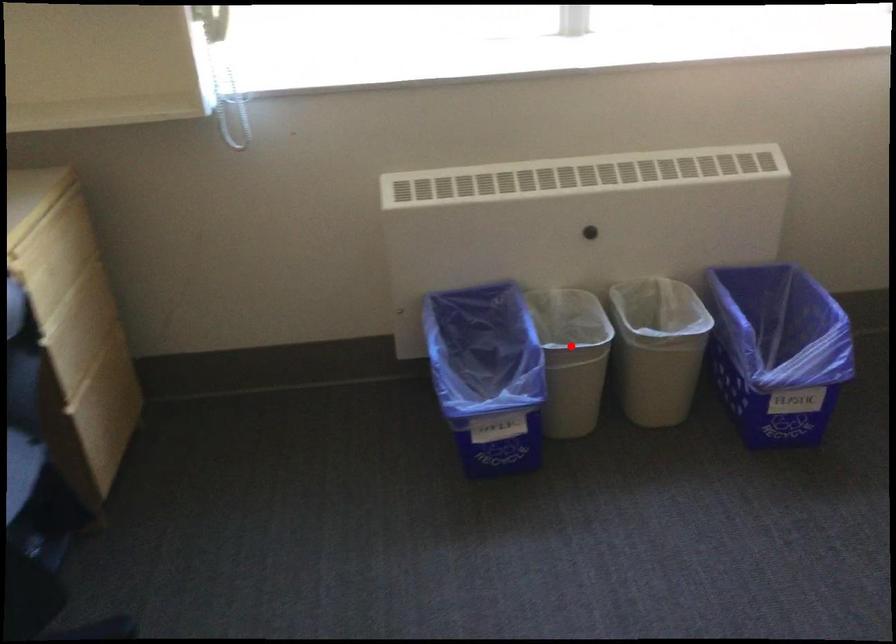
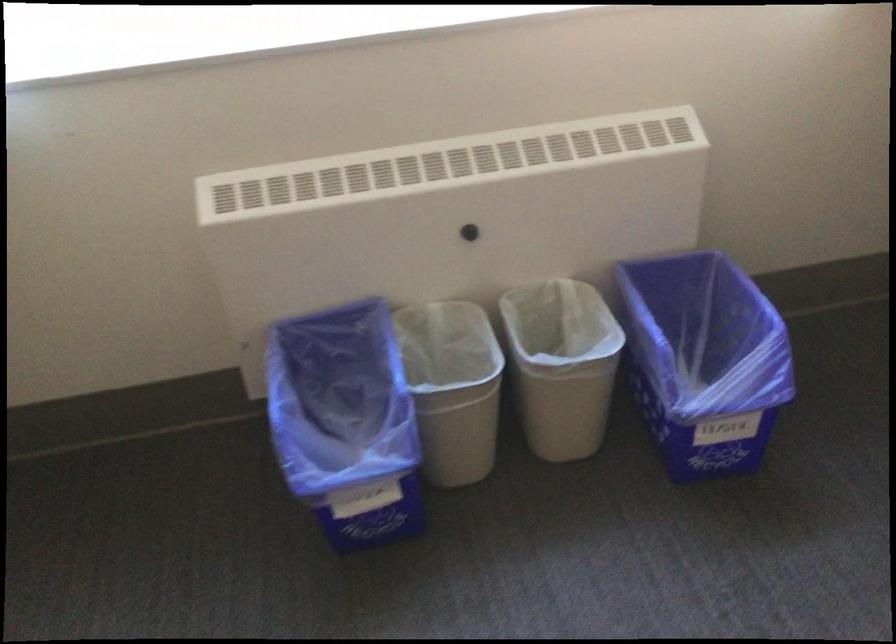
Locate, in the second image, the point that corresponds to the highlighted location in the first image.

(452, 386)